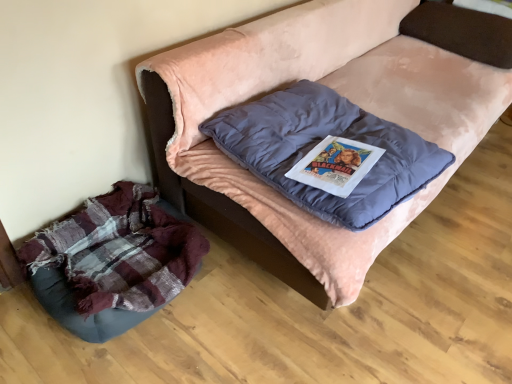
Question: Considering the positions of velvet blue pillow at upper right, which is the second pillow in left-to-right order, and plaid fabric dog bed at lower left in the image, is velvet blue pillow at upper right, which is the second pillow in left-to-right order, wider or thinner than plaid fabric dog bed at lower left?

Choices:
 (A) thin
 (B) wide

Answer: (B)

Question: Is velvet blue pillow at upper right, the 2th pillow positioned from the bottom, in front of or behind plaid fabric dog bed at lower left in the image?

Choices:
 (A) behind
 (B) front

Answer: (A)

Question: Which object is the closest to the velvet blue pillow at upper right, which ranks as the second pillow in front-to-back order?

Choices:
 (A) plaid fabric dog bed at lower left
 (B) velvet blue pillow at center, which is the 2th pillow from top to bottom
 (C) velvet pink couch at center

Answer: (C)

Question: Which of these objects is positioned closest to the velvet blue pillow at upper right, the 2th pillow positioned from the bottom?

Choices:
 (A) velvet blue pillow at center, positioned as the first pillow in bottom-to-top order
 (B) velvet pink couch at center
 (C) plaid fabric dog bed at lower left

Answer: (B)